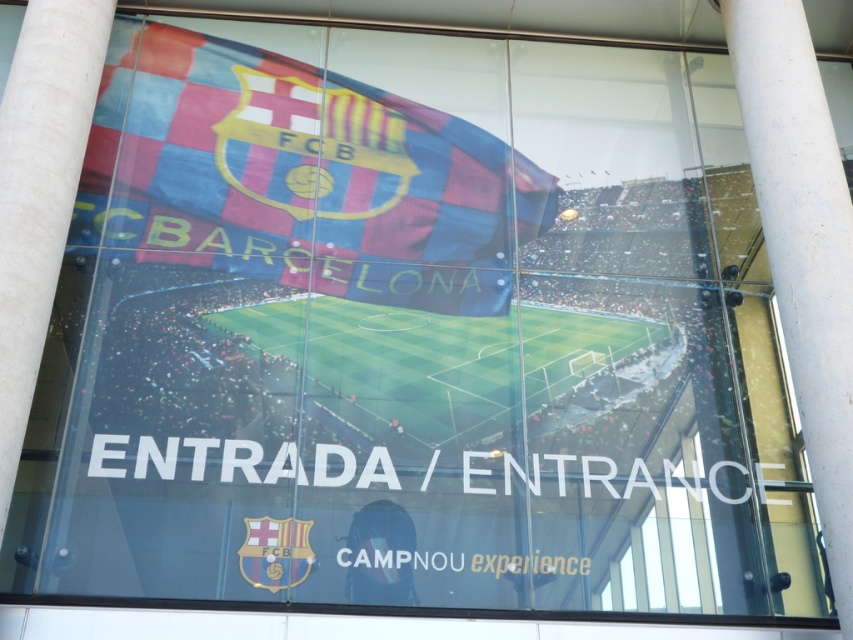
You are standing in front of the Camp Nou entrance sign. You need to pass through the entrance. Which object, the white glossy pillar at right or the transparent glass window at center, should you walk towards to enter?

You should walk towards the transparent glass window at center because the white glossy pillar at right is narrower than the transparent glass window at center, so the window is wider and more likely to be the entrance path.

You are a visitor at the Camp Nou entrance and want to locate the entrance sign. The sign has two objects at its center. Which object is taller, the polyester flag at center or the transparent glass window at center?

The polyester flag at center is taller than the transparent glass window at center according to the description.